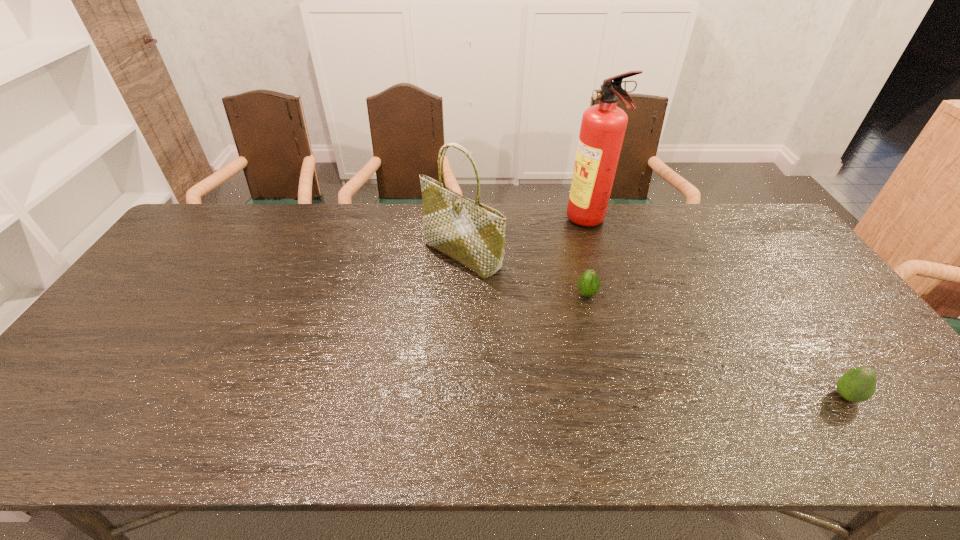
Where is `vacant space at the far right corner`? The width and height of the screenshot is (960, 540). vacant space at the far right corner is located at coordinates (725, 206).

You are a GUI agent. You are given a task and a screenshot of the screen. Output one action in this format:
    pyautogui.click(x=<x>, y=<y>)
    Task: Click on the free spot at the near right corner of the desktop
    Image resolution: width=960 pixels, height=540 pixels.
    Given the screenshot: What is the action you would take?
    pyautogui.click(x=922, y=428)

The height and width of the screenshot is (540, 960). I want to click on empty space between the right avocado and the fire extinguisher, so click(717, 309).

I want to click on free point between the nearest object and the tallest object, so click(x=717, y=309).

I want to click on blank region between the farther avocado and the rightmost object, so click(716, 346).

The width and height of the screenshot is (960, 540). In order to click on vacant region between the nearest object and the second tallest object in this screenshot , I will do `click(654, 326)`.

The height and width of the screenshot is (540, 960). What are the coordinates of `vacant area that lies between the tallest object and the farther avocado` in the screenshot? It's located at (588, 258).

Locate an element on the screen. The image size is (960, 540). free space between the leftmost object and the fire extinguisher is located at coordinates (525, 239).

Locate an element on the screen. Image resolution: width=960 pixels, height=540 pixels. empty space between the farther avocado and the fire extinguisher is located at coordinates (588, 258).

Locate an element on the screen. vacant space that is in between the tallest object and the second nearest object is located at coordinates (588, 258).